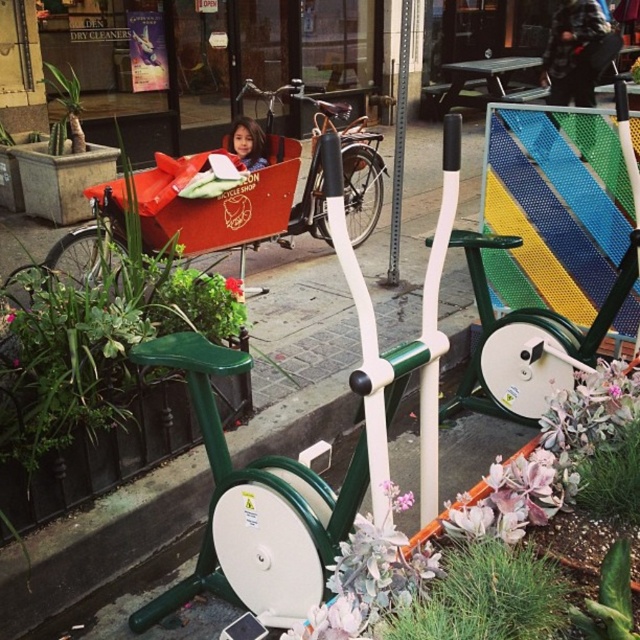
You are a delivery person with a package that needs to be placed between the matte orange cargo bike at center and the green leafy plant at left. The package measures 5 feet in length. Will there be enough space to place it there?

The distance between the matte orange cargo bike at center and the green leafy plant at left is 6.03 feet, which is slightly longer than the package length of 5 feet. Therefore, there is enough space to place the package between them.

You are a delivery person who needs to load a package onto the matte orange cargo bike at center and the matte red cargo bike at center. Since both bikes are parked close to each other, which bike should you approach first to ensure you can access both without moving them?

You should approach the matte orange cargo bike at center first because it is positioned to the left of the matte red cargo bike at center. By starting with the leftmost bike, you can easily access both bikes without needing to move them, as they are parked side by side.

You are standing in the urban scene and want to take a photo of the metallic pole at center and the green leafy plant at left. Which object should you position to your left to include both in the frame?

You should position the green leafy plant at left to your left since the metallic pole at center is to the right of it.